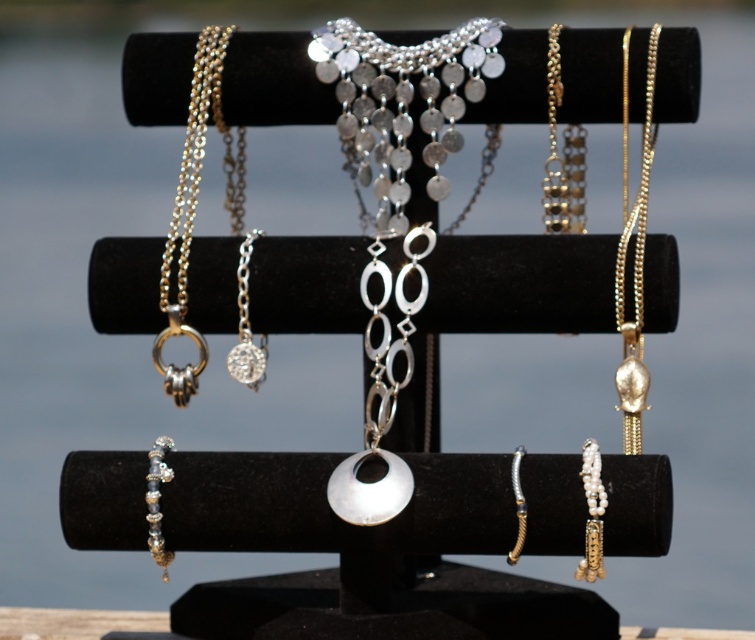
Question: Does gold chain necklace at right lie behind gold textured bracelet at center?

Choices:
 (A) no
 (B) yes

Answer: (B)

Question: Can you confirm if gold chain necklace at right is positioned above gold chain link necklace at upper right?

Choices:
 (A) yes
 (B) no

Answer: (B)

Question: Which point appears farthest from the camera in this image?

Choices:
 (A) (522, 532)
 (B) (550, 77)

Answer: (B)

Question: In this image, where is gold chain link necklace at upper right located relative to gold textured bracelet at center?

Choices:
 (A) below
 (B) above

Answer: (B)

Question: Which point is farther from the camera taking this photo?

Choices:
 (A) (516, 488)
 (B) (635, 323)

Answer: (B)

Question: Estimate the real-world distances between objects in this image. Which object is farther from the gold chain link necklace at upper right?

Choices:
 (A) gold chain necklace at right
 (B) gold textured bracelet at center

Answer: (B)